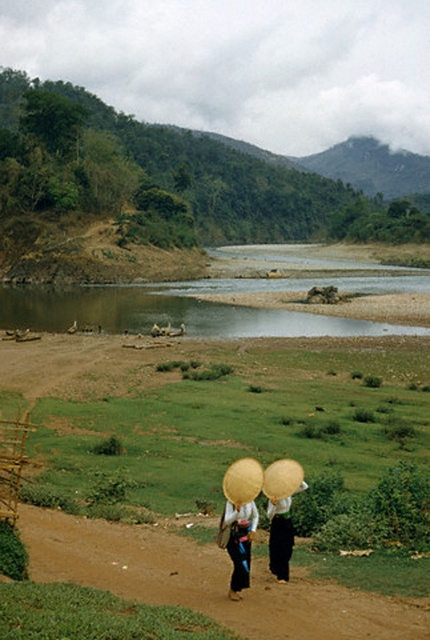
Does brown dirt path at lower center have a lesser height compared to brown sedimentary river at center?

Yes.

Between brown dirt path at lower center and brown sedimentary river at center, which one is positioned higher?

brown sedimentary river at center is higher up.

Which is behind, point (298, 605) or point (107, 326)?

Positioned behind is point (107, 326).

Locate an element on the screen. The height and width of the screenshot is (640, 430). brown dirt path at lower center is located at coordinates (208, 580).

Consider the image. Can you confirm if brown dirt path at lower center is wider than wooden woven basket at lower left?

No.

Which is more to the left, brown dirt path at lower center or wooden woven basket at lower left?

From the viewer's perspective, wooden woven basket at lower left appears more on the left side.

Where is `brown dirt path at lower center`? The image size is (430, 640). brown dirt path at lower center is located at coordinates (208, 580).

This screenshot has height=640, width=430. Find the location of `brown dirt path at lower center`. brown dirt path at lower center is located at coordinates (208, 580).

Can you confirm if brown sedimentary river at center is positioned above wooden woven basket at lower left?

Correct, brown sedimentary river at center is located above wooden woven basket at lower left.

Looking at this image, does brown sedimentary river at center have a larger size compared to wooden woven basket at lower left?

Indeed, brown sedimentary river at center has a larger size compared to wooden woven basket at lower left.

The width and height of the screenshot is (430, 640). What do you see at coordinates (220, 292) in the screenshot?
I see `brown sedimentary river at center` at bounding box center [220, 292].

Image resolution: width=430 pixels, height=640 pixels. Identify the location of brown sedimentary river at center. 220,292.